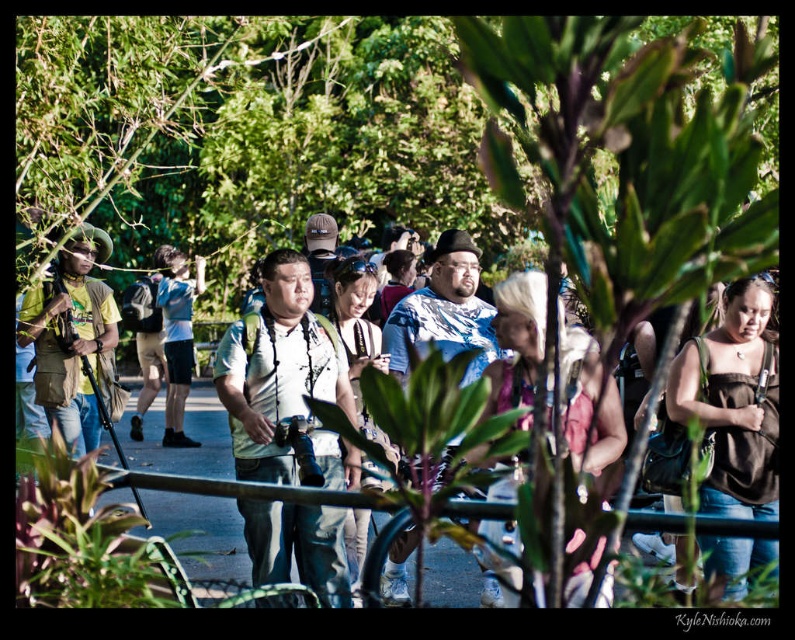
Question: Can you confirm if green matte shirt at left is smaller than blue patterned shirt at center?

Choices:
 (A) no
 (B) yes

Answer: (A)

Question: Which object is the closest to the matte white shirt at center?

Choices:
 (A) blue patterned shirt at center
 (B) light brown leather jacket at center
 (C) matte black backpack at center

Answer: (B)

Question: Does matte white shirt at center appear over matte black backpack at center?

Choices:
 (A) yes
 (B) no

Answer: (A)

Question: Does blue denim shorts at center have a larger size compared to matte black backpack at center?

Choices:
 (A) no
 (B) yes

Answer: (A)

Question: Which point is farther to the camera?

Choices:
 (A) (382, 356)
 (B) (444, 317)
 (C) (727, 337)
 (D) (45, 288)

Answer: (D)

Question: Which point is closer to the camera?

Choices:
 (A) brown fabric purse at right
 (B) matte white shirt at center
 (C) matte black backpack at center

Answer: (A)